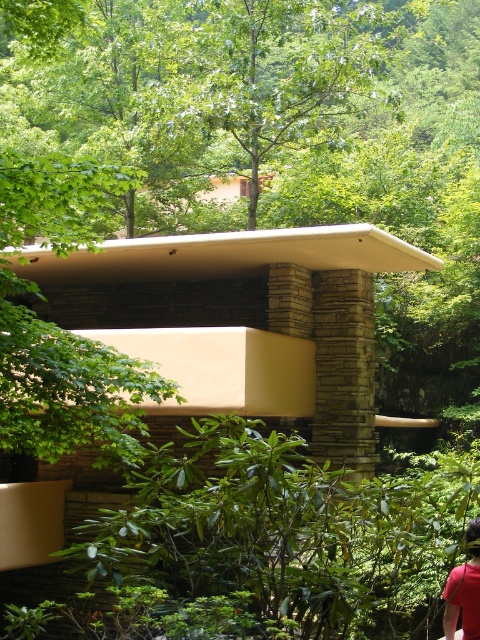
Question: Is beige stone shelter at center thinner than red shirt at lower right?

Choices:
 (A) no
 (B) yes

Answer: (A)

Question: Which of the following is the closest to the observer?

Choices:
 (A) (90, 253)
 (B) (446, 636)

Answer: (B)

Question: From the image, what is the correct spatial relationship of beige stone shelter at center in relation to red shirt at lower right?

Choices:
 (A) right
 (B) left

Answer: (B)

Question: Which of the following is the farthest from the observer?

Choices:
 (A) red shirt at lower right
 (B) beige stone shelter at center

Answer: (B)

Question: Which object is closer to the camera taking this photo?

Choices:
 (A) red shirt at lower right
 (B) beige stone shelter at center

Answer: (A)

Question: Is beige stone shelter at center positioned at the back of red shirt at lower right?

Choices:
 (A) no
 (B) yes

Answer: (B)